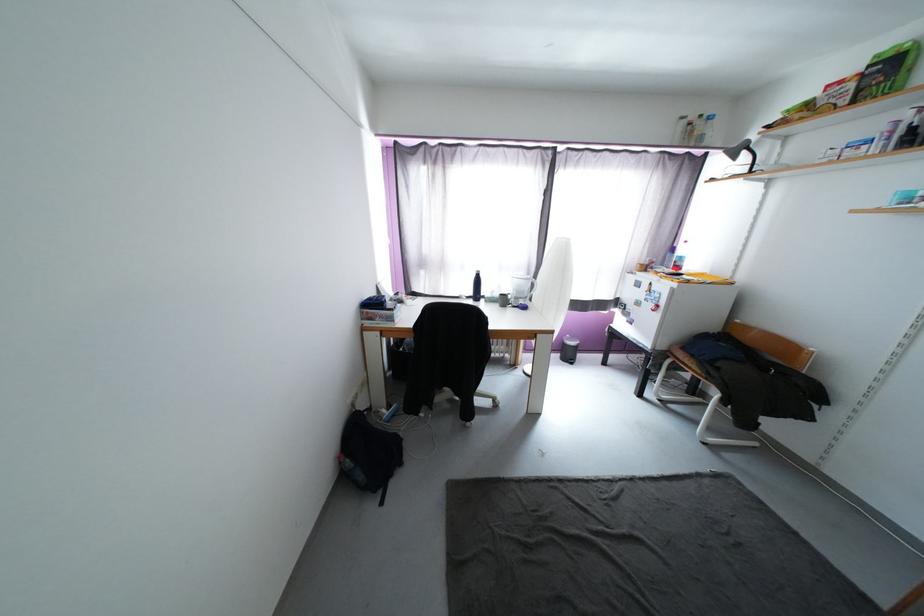
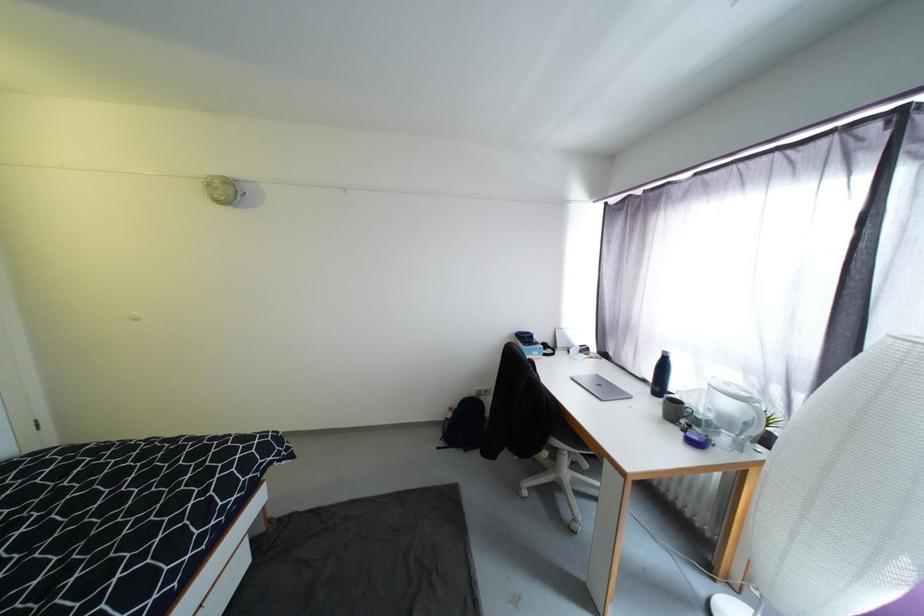
Locate, in the second image, the point that corresponds to (x=508, y=302) in the first image.

(683, 413)